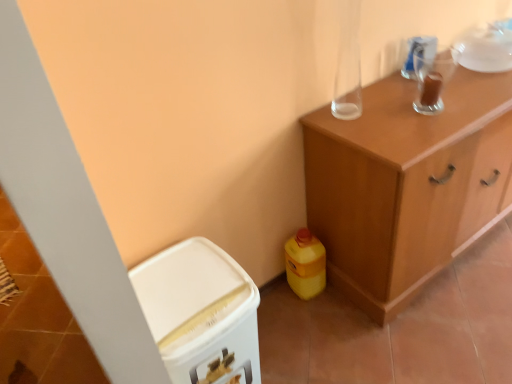
Locate an element on the screen. This screenshot has width=512, height=384. unoccupied area behind transparent glass cup at upper right is located at coordinates (404, 86).